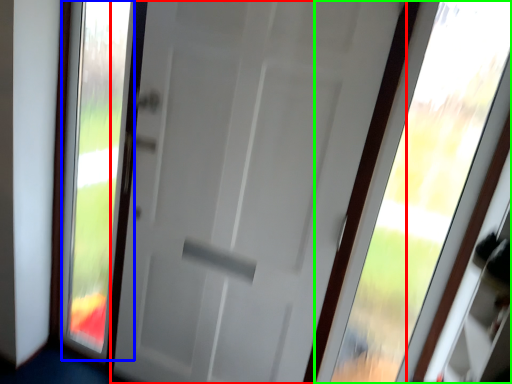
Question: Which is nearer to the door (highlighted by a red box)? glass window (highlighted by a blue box) or window (highlighted by a green box).

Choices:
 (A) glass window
 (B) window

Answer: (A)